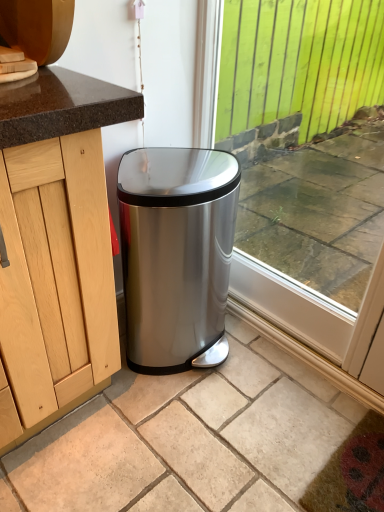
Where is `empty space that is ontop of satin metallic trash can at lower center (from a real-world perspective)`? The height and width of the screenshot is (512, 384). empty space that is ontop of satin metallic trash can at lower center (from a real-world perspective) is located at coordinates (207, 424).